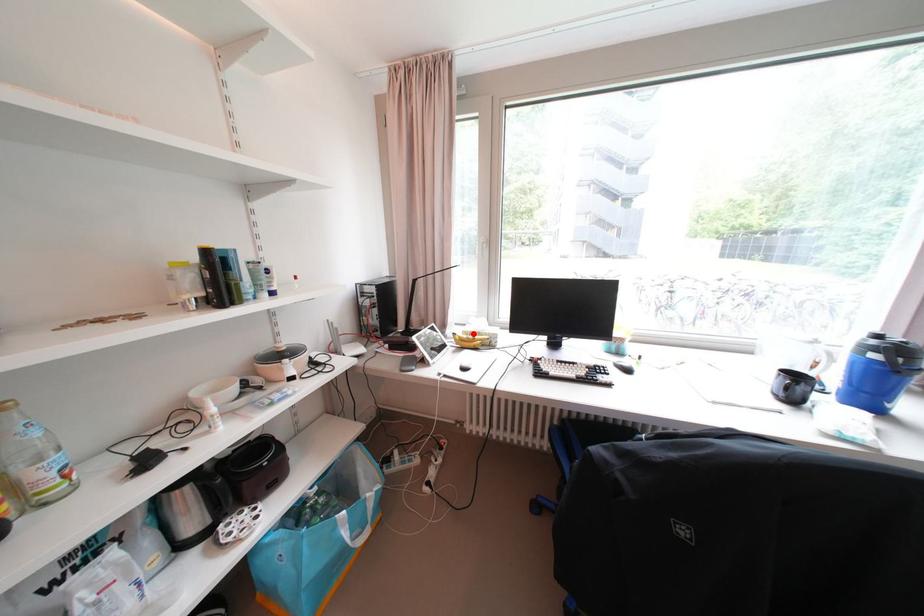
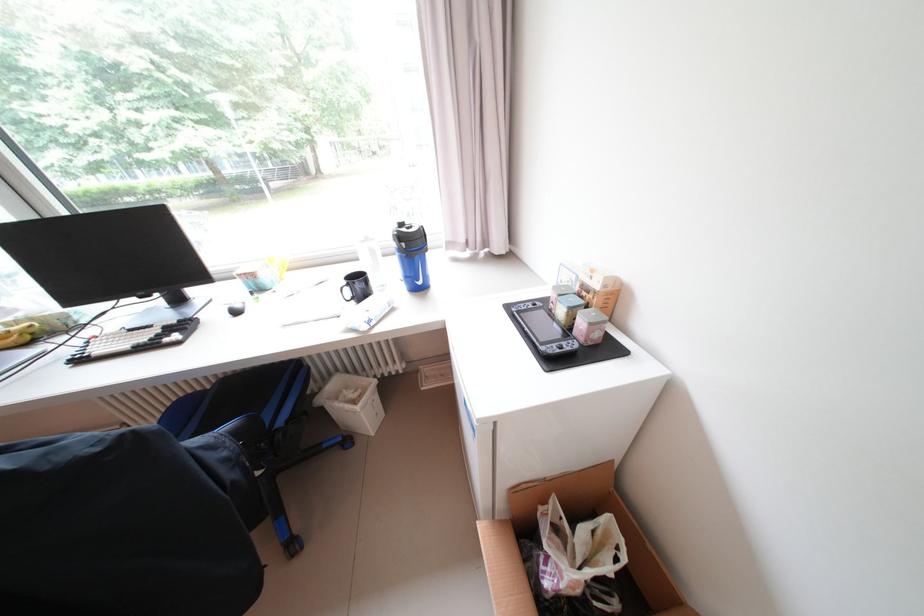
Question: I am providing you with two images of the same scene from different viewpoints. Given a red point in image1, look at the same physical point in image2. Is it:

Choices:
 (A) Closer to the viewpoint
 (B) Farther from the viewpoint

Answer: (B)